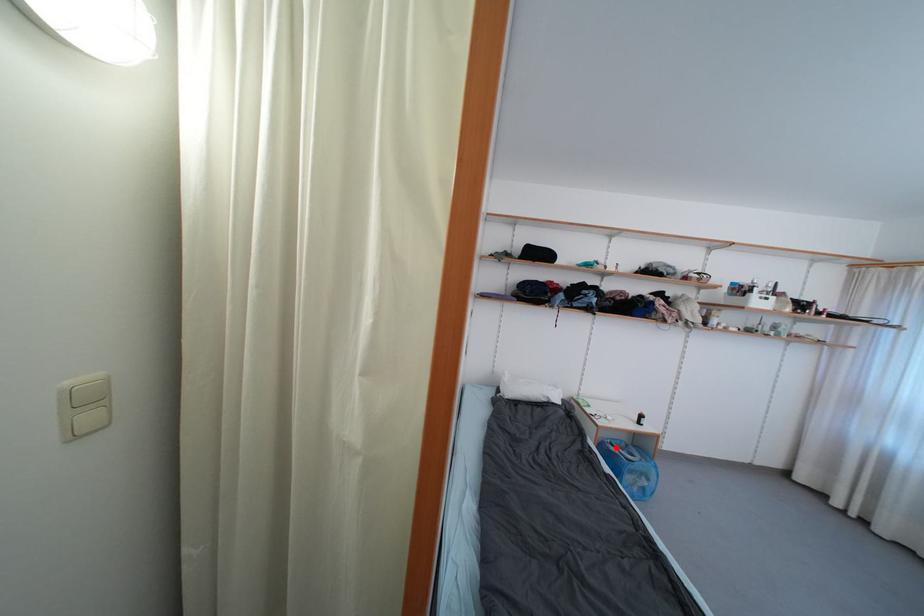
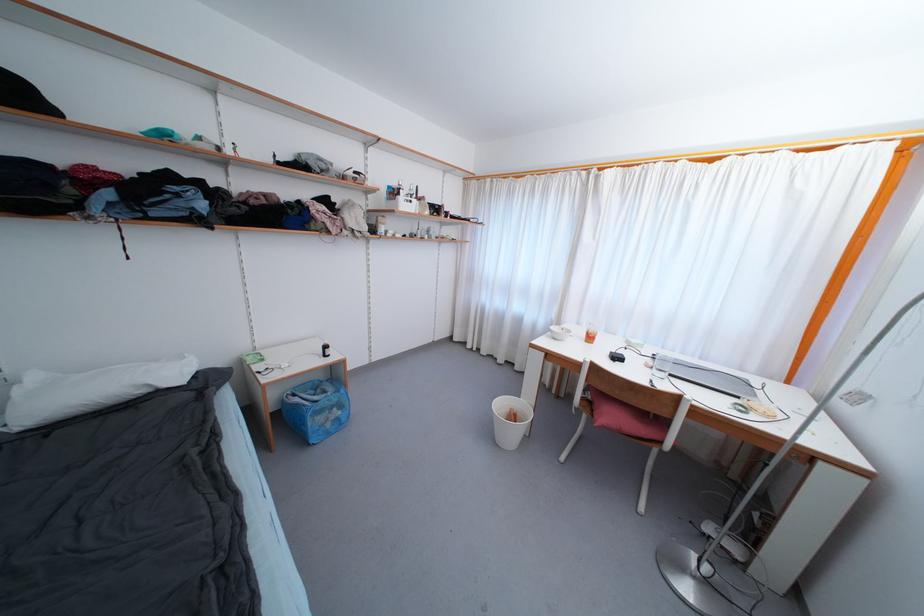
In the second image, find the point that corresponds to the highlighted location in the first image.

(298, 398)